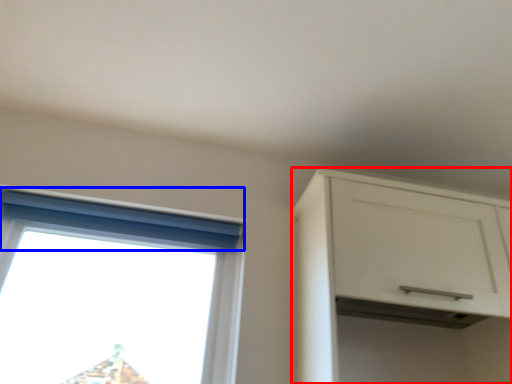
Question: Which object appears farthest to the camera in this image, cabinetry (highlighted by a red box) or curtain (highlighted by a blue box)?

Choices:
 (A) cabinetry
 (B) curtain

Answer: (B)